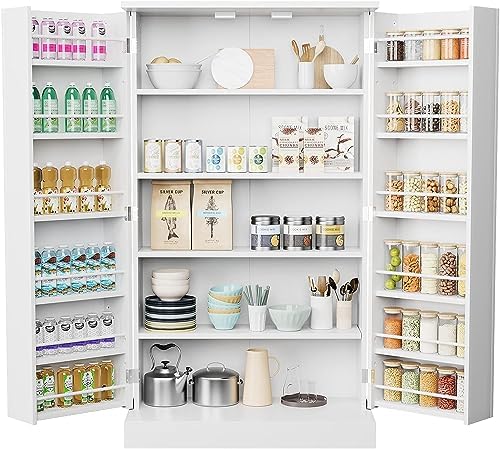
The height and width of the screenshot is (449, 500). Identify the location of glass jars on the fifth shelf. (461, 334), (448, 331), (428, 332), (411, 329), (394, 327).